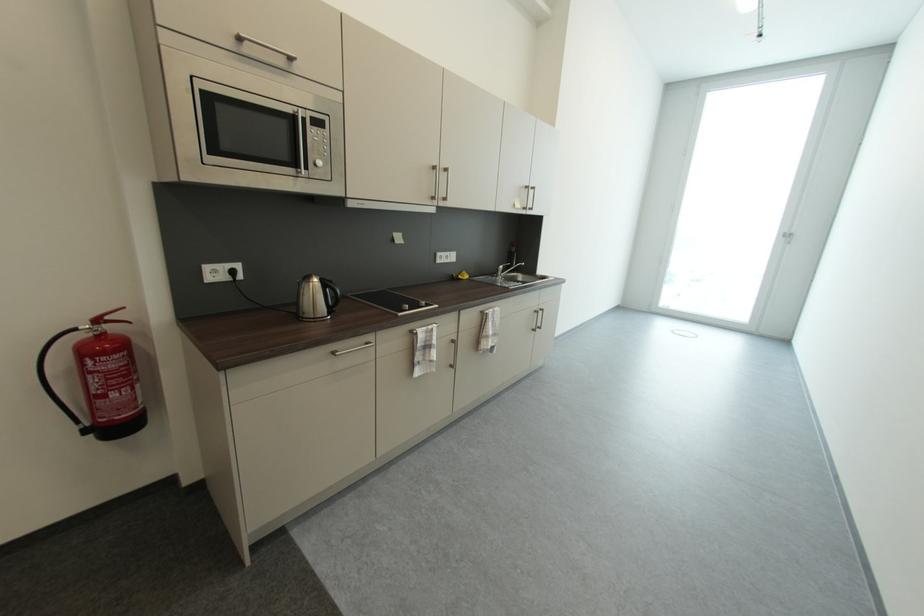
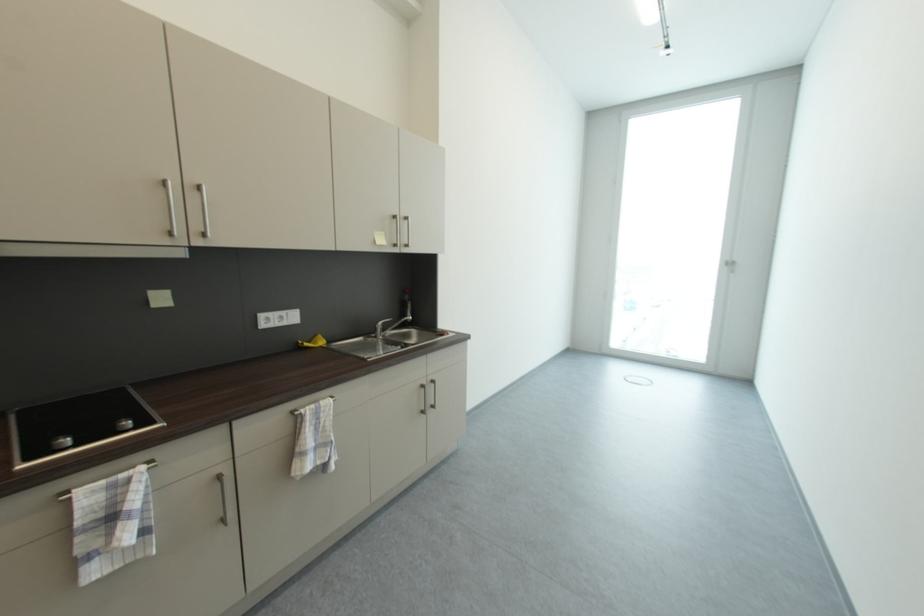
Which direction would the cameraman need to move to produce the second image?

The cameraman moved toward right, forward.